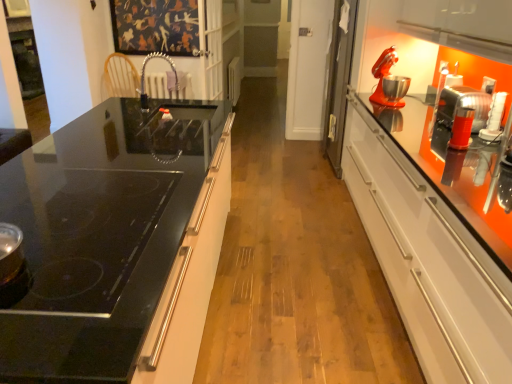
At what (x,y) coordinates should I click in order to perform the action: click on free spot to the right of white plastic radiator at center, acting as the first appliance starting from the top. Please return your answer as a coordinate pair (x, y). This screenshot has width=512, height=384. Looking at the image, I should click on (256, 110).